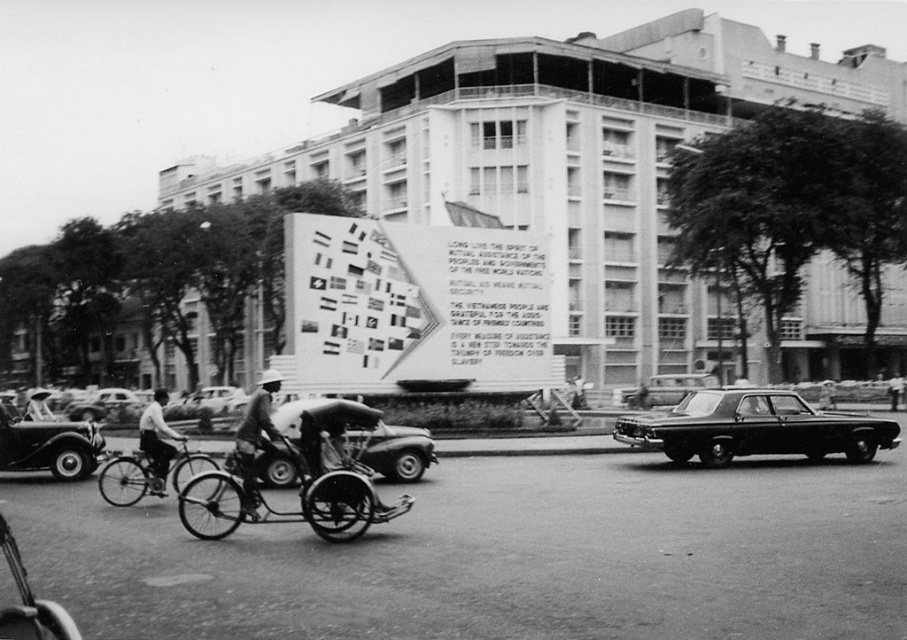
Question: Estimate the real-world distances between objects in this image. Which object is farther from the dark gray fabric hat at center?

Choices:
 (A) shiny black car at left
 (B) dark gray fabric shirt at center
 (C) shiny silver bicycle at center-left

Answer: (A)

Question: Does shiny black sedan at right appear on the left side of dark gray fabric hat at center?

Choices:
 (A) no
 (B) yes

Answer: (A)

Question: Among these points, which one is nearest to the camera?

Choices:
 (A) (713, 451)
 (B) (278, 385)
 (C) (194, 458)

Answer: (B)

Question: Which point appears farthest from the camera in this image?

Choices:
 (A) (769, 440)
 (B) (274, 422)
 (C) (666, 394)
 (D) (138, 435)

Answer: (C)

Question: Is metallic silver car at center to the left of shiny silver bicycle at center-left from the viewer's perspective?

Choices:
 (A) yes
 (B) no

Answer: (B)

Question: Is shiny silver bicycle at center-left to the left of dark gray fabric hat at center from the viewer's perspective?

Choices:
 (A) yes
 (B) no

Answer: (B)